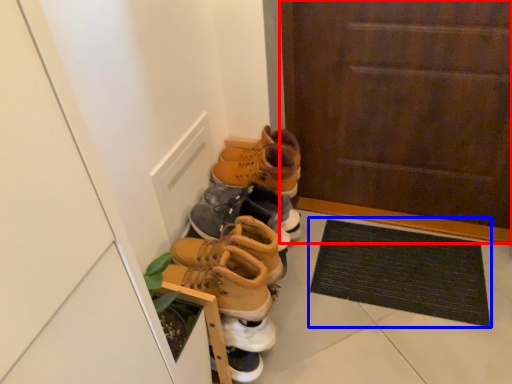
Question: Which point is further to the camera, door (highlighted by a red box) or doormat (highlighted by a blue box)?

Choices:
 (A) door
 (B) doormat

Answer: (B)